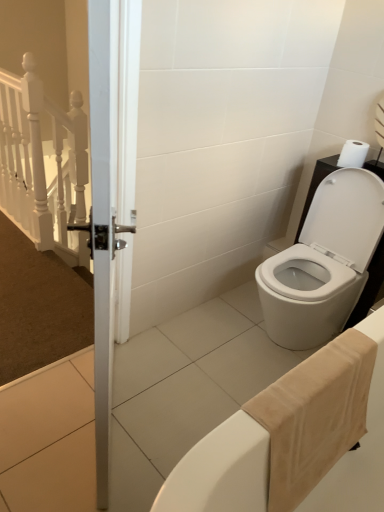
Question: From a real-world perspective, is beige cotton bath towel at lower right physically below white matte toilet paper at upper right?

Choices:
 (A) no
 (B) yes

Answer: (B)

Question: Is beige cotton bath towel at lower right positioned in front of white matte toilet paper at upper right?

Choices:
 (A) no
 (B) yes

Answer: (B)

Question: Could you tell me if beige cotton bath towel at lower right is facing white matte toilet paper at upper right?

Choices:
 (A) yes
 (B) no

Answer: (B)

Question: Does beige cotton bath towel at lower right have a lesser height compared to white matte toilet paper at upper right?

Choices:
 (A) yes
 (B) no

Answer: (B)

Question: Is beige cotton bath towel at lower right taller than white matte toilet paper at upper right?

Choices:
 (A) no
 (B) yes

Answer: (B)

Question: From a real-world perspective, is beige cotton bath towel at lower right positioned over white matte toilet paper at upper right based on gravity?

Choices:
 (A) no
 (B) yes

Answer: (A)

Question: Is white matte toilet paper at upper right further to camera compared to white glossy toilet at lower right?

Choices:
 (A) no
 (B) yes

Answer: (B)

Question: Is white matte toilet paper at upper right touching white glossy toilet at lower right?

Choices:
 (A) no
 (B) yes

Answer: (A)

Question: Is white matte toilet paper at upper right aimed at white glossy toilet at lower right?

Choices:
 (A) no
 (B) yes

Answer: (A)

Question: Considering the relative positions of white matte toilet paper at upper right and white glossy toilet at lower right in the image provided, is white matte toilet paper at upper right in front of white glossy toilet at lower right?

Choices:
 (A) yes
 (B) no

Answer: (B)

Question: From a real-world perspective, does white matte toilet paper at upper right stand above white glossy toilet at lower right?

Choices:
 (A) no
 (B) yes

Answer: (B)

Question: Can you confirm if white matte toilet paper at upper right is wider than white glossy toilet at lower right?

Choices:
 (A) yes
 (B) no

Answer: (B)

Question: Would you say white matte toilet paper at upper right is outside beige cotton bath towel at lower right?

Choices:
 (A) no
 (B) yes

Answer: (B)